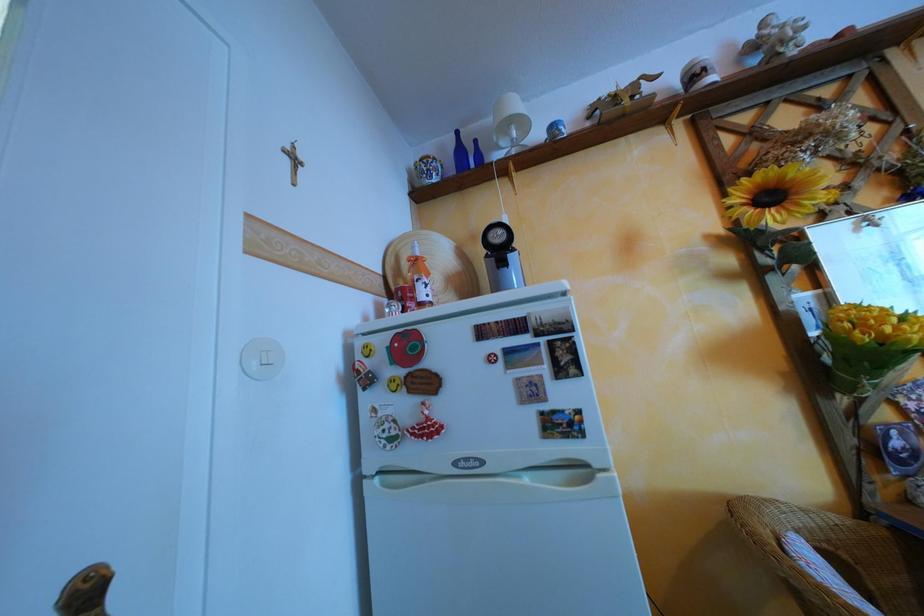
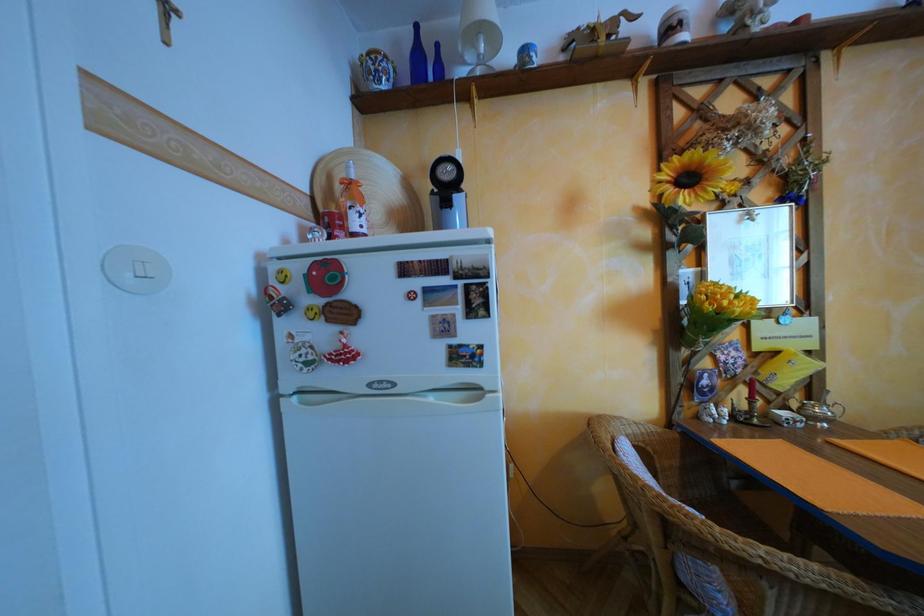
Question: The images are taken continuously from a first-person perspective. In which direction are you moving?

Choices:
 (A) Left
 (B) Right
 (C) Forward
 (D) Backward

Answer: (B)